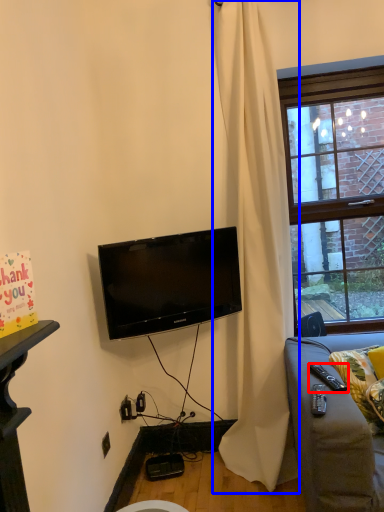
Question: Which object is closer to the camera taking this photo, remote control (highlighted by a red box) or curtain (highlighted by a blue box)?

Choices:
 (A) remote control
 (B) curtain

Answer: (A)